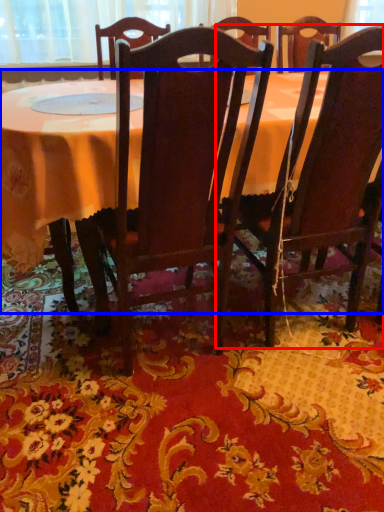
Question: Which of the following is the farthest to the observer, chair (highlighted by a red box) or table (highlighted by a blue box)?

Choices:
 (A) chair
 (B) table

Answer: (B)